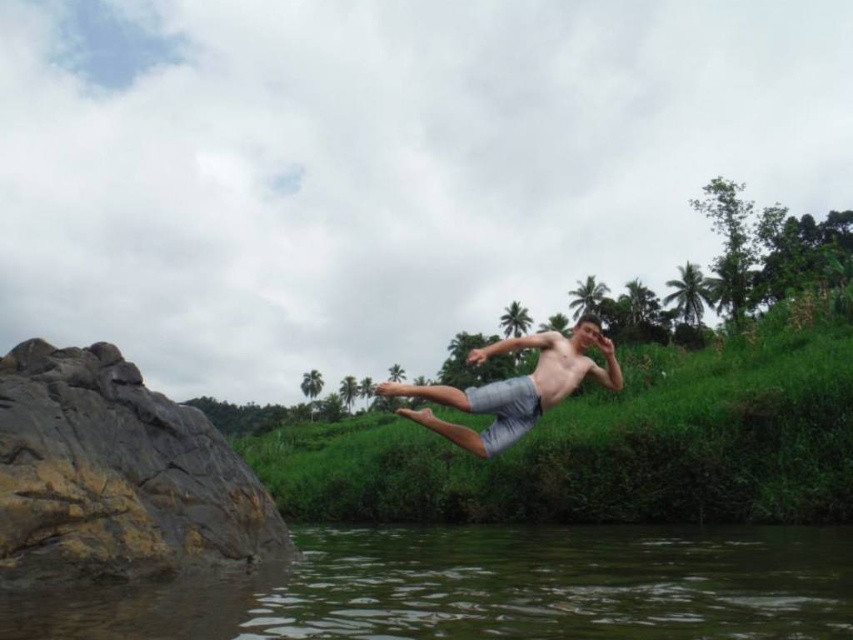
Based on the photo, between greenish-brown water at lower center and brown rough rock at left, which one appears on the left side from the viewer's perspective?

From the viewer's perspective, brown rough rock at left appears more on the left side.

Does point (677, 602) come closer to viewer compared to point (6, 490)?

That is True.

Which is behind, point (55, 632) or point (225, 484)?

Positioned behind is point (225, 484).

The image size is (853, 640). Identify the location of greenish-brown water at lower center. (482, 588).

Which of these two, greenish-brown water at lower center or gray cotton shorts at center, stands shorter?

With less height is greenish-brown water at lower center.

Is point (358, 595) positioned in front of point (538, 412)?

Yes.

Where is `greenish-brown water at lower center`? greenish-brown water at lower center is located at coordinates (482, 588).

Who is more forward, (6, 408) or (453, 397)?

Point (6, 408)

Between brown rough rock at left and gray cotton shorts at center, which one appears on the right side from the viewer's perspective?

From the viewer's perspective, gray cotton shorts at center appears more on the right side.

At what (x,y) coordinates should I click in order to perform the action: click on brown rough rock at left. Please return your answer as a coordinate pair (x, y). The height and width of the screenshot is (640, 853). Looking at the image, I should click on (115, 474).

Identify the location of brown rough rock at left. (115, 474).